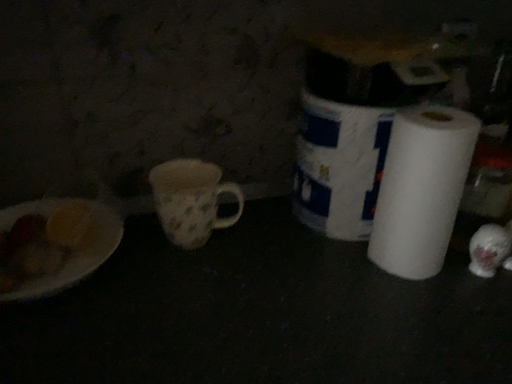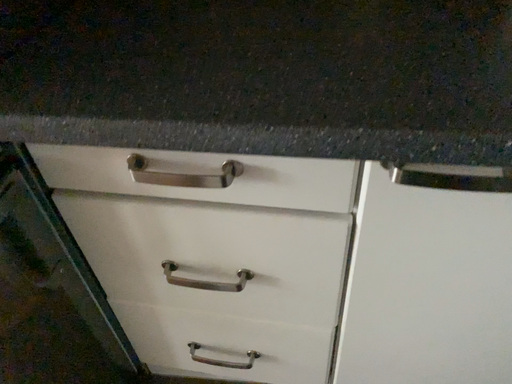
Question: How did the camera likely rotate when shooting the video?

Choices:
 (A) rotated upward
 (B) rotated downward

Answer: (B)